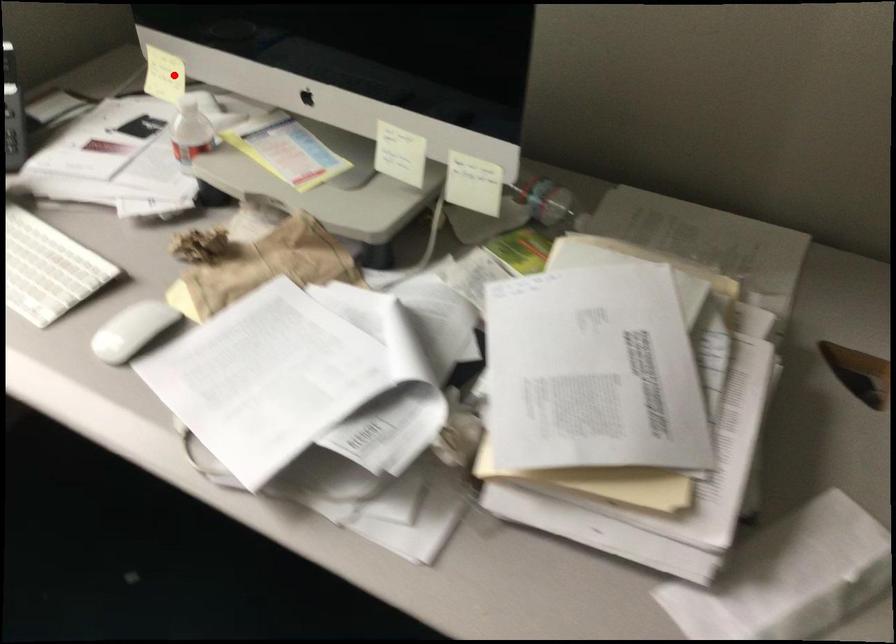
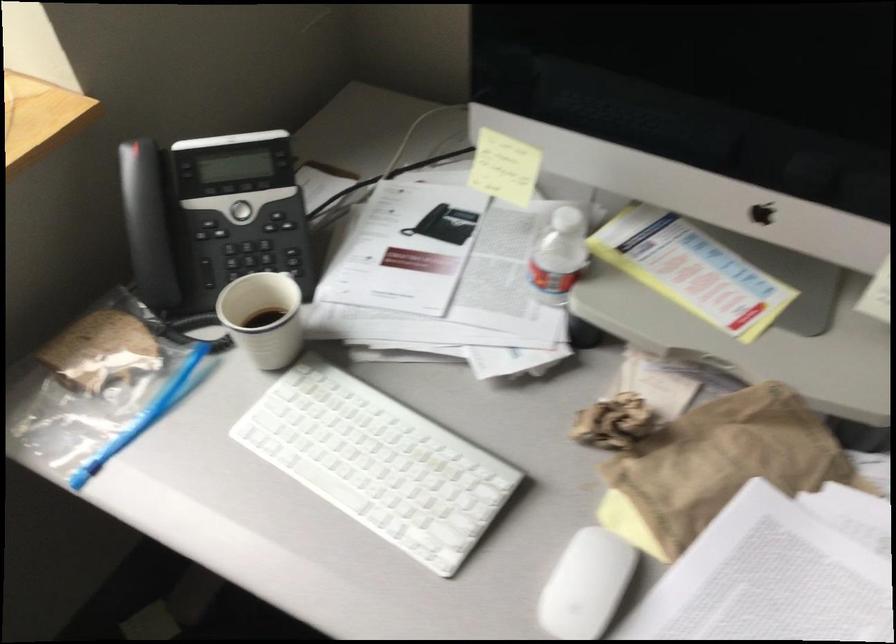
Question: A red point is marked in image1. In image2, is the corresponding 3D point closer to the camera or farther? Reply with the corresponding letter.

Choices:
 (A) The corresponding 3D point is closer.
 (B) The corresponding 3D point is farther.

Answer: (A)